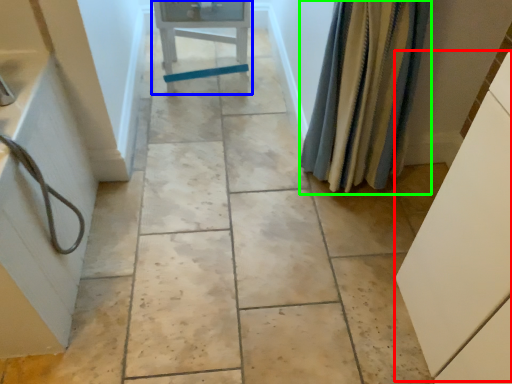
Question: Which is nearer to the cabinetry (highlighted by a red box)? furniture (highlighted by a blue box) or shower curtain (highlighted by a green box).

Choices:
 (A) furniture
 (B) shower curtain

Answer: (B)